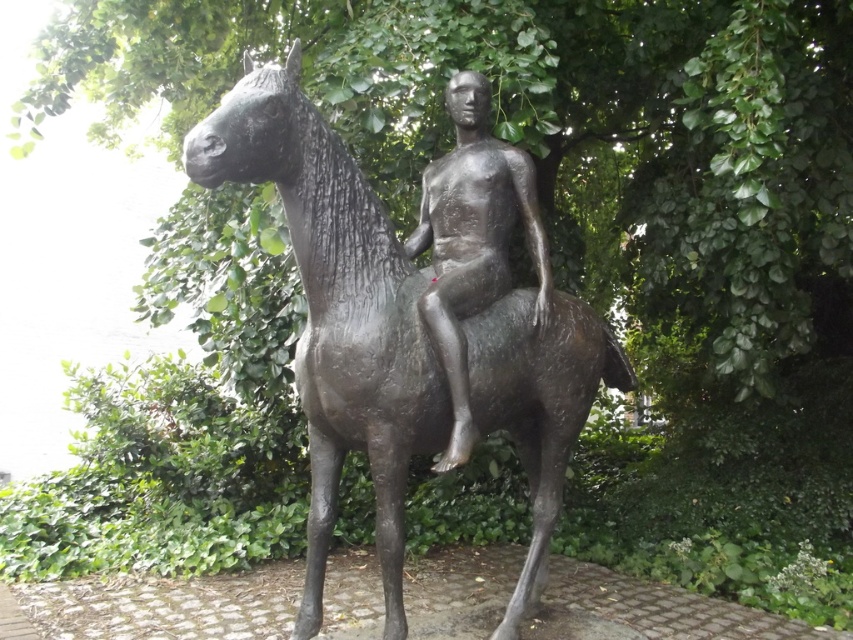
Does bronze statue of a horse at center have a smaller size compared to polished bronze statue at center?

Incorrect, bronze statue of a horse at center is not smaller in size than polished bronze statue at center.

Is point (329, 305) closer to viewer compared to point (488, 150)?

Yes, it is in front of point (488, 150).

Locate an element on the screen. This screenshot has width=853, height=640. bronze statue of a horse at center is located at coordinates (413, 316).

From the picture: Between green leafy tree at center and polished bronze statue at center, which one has more height?

polished bronze statue at center is taller.

Is green leafy tree at center in front of polished bronze statue at center?

No, green leafy tree at center is behind polished bronze statue at center.

Who is more distant from viewer, (770, 269) or (477, 205)?

Point (770, 269)

You are a GUI agent. You are given a task and a screenshot of the screen. Output one action in this format:
    pyautogui.click(x=<x>, y=<y>)
    Task: Click on the green leafy tree at center
    This screenshot has height=640, width=853.
    Given the screenshot: What is the action you would take?
    pyautogui.click(x=550, y=136)

Can you confirm if green leafy tree at center is positioned to the right of bronze statue of a horse at center?

Indeed, green leafy tree at center is positioned on the right side of bronze statue of a horse at center.

Is green leafy tree at center above bronze statue of a horse at center?

Indeed, green leafy tree at center is positioned over bronze statue of a horse at center.

Is point (811, 120) more distant than point (239, 163)?

That is True.

Locate an element on the screen. green leafy tree at center is located at coordinates (550, 136).